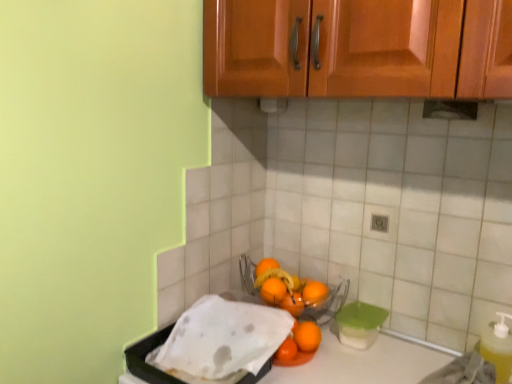
Describe the element at coordinates (224, 337) in the screenshot. The width and height of the screenshot is (512, 384). I see `white paper towel at lower left, which is counted as the second wash, starting from the right` at that location.

Image resolution: width=512 pixels, height=384 pixels. Find the location of `orange matte at lower center, positioned as the 5th orange in bottom-to-top order`. orange matte at lower center, positioned as the 5th orange in bottom-to-top order is located at coordinates (266, 266).

This screenshot has width=512, height=384. What do you see at coordinates (498, 347) in the screenshot?
I see `yellow translucent bottle at lower right` at bounding box center [498, 347].

Describe the element at coordinates (293, 304) in the screenshot. This screenshot has height=384, width=512. I see `orange matte at center, marked as the 4th orange in a top-to-bottom arrangement` at that location.

Measure the distance between point (300, 332) and camera.

Point (300, 332) is 1.12 meters from camera.

What is the approximate width of orange matte at center, the third orange when ordered from top to bottom?

It is 6.79 centimeters.

Locate an element on the screen. white paper towel at lower left, which is counted as the second wash, starting from the right is located at coordinates (224, 337).

Between point (307, 337) and point (291, 306), which one is positioned in front?

The point (307, 337) is in front.

Is orange matte bowl at center, positioned as the 1th wash in right-to-left order, thinner than orange matte at center, marked as the 4th orange in a top-to-bottom arrangement?

Incorrect, the width of orange matte bowl at center, positioned as the 1th wash in right-to-left order, is not less than that of orange matte at center, marked as the 4th orange in a top-to-bottom arrangement.

How different are the orientations of orange matte bowl at center, which is counted as the second wash, starting from the left, and orange matte at center, the 2th orange positioned from the bottom, in degrees?

There is a 0.00176-degree angle between the facing directions of orange matte bowl at center, which is counted as the second wash, starting from the left, and orange matte at center, the 2th orange positioned from the bottom.

Measure the distance from orange matte at lower center, positioned as the 5th orange in bottom-to-top order, to orange matte at center, the 4th orange when ordered from bottom to top.

The distance of orange matte at lower center, positioned as the 5th orange in bottom-to-top order, from orange matte at center, the 4th orange when ordered from bottom to top, is 2.44 inches.

Between orange matte at lower center, positioned as the 5th orange in bottom-to-top order, and orange matte at center, the 4th orange when ordered from bottom to top, which one has more height?

orange matte at lower center, positioned as the 5th orange in bottom-to-top order.

Based on the photo, from the image's perspective, would you say orange matte at lower center, positioned as the 5th orange in bottom-to-top order, is shown under orange matte at center, placed as the second orange when sorted from top to bottom?

No.

Based on the photo, would you say orange matte at center, placed as the second orange when sorted from top to bottom, is part of orange matte at lower center, the 1th orange in the top-to-bottom sequence,'s contents?

No.

Who is taller, orange matte at lower right, which is the 5th orange in top-to-bottom order, or yellow translucent bottle at lower right?

yellow translucent bottle at lower right is taller.

Which object is closer to the camera taking this photo, orange matte at lower right, the 1th orange ordered from the bottom, or yellow translucent bottle at lower right?

yellow translucent bottle at lower right is more forward.

Consider the image. Is orange matte at lower right, the 1th orange ordered from the bottom, completely or partially outside of yellow translucent bottle at lower right?

That's correct, orange matte at lower right, the 1th orange ordered from the bottom, is outside of yellow translucent bottle at lower right.

How many degrees apart are the facing directions of orange matte at lower right, the 1th orange ordered from the bottom, and yellow translucent bottle at lower right?

orange matte at lower right, the 1th orange ordered from the bottom, and yellow translucent bottle at lower right are facing 0.000612 degrees away from each other.

Is the surface of orange matte at lower center, positioned as the 5th orange in bottom-to-top order, in direct contact with orange matte at center, marked as the 4th orange in a top-to-bottom arrangement?

No.

Considering the relative sizes of orange matte at lower center, the 1th orange in the top-to-bottom sequence, and orange matte at center, the 2th orange positioned from the bottom, in the image provided, is orange matte at lower center, the 1th orange in the top-to-bottom sequence, thinner than orange matte at center, the 2th orange positioned from the bottom,?

Incorrect, the width of orange matte at lower center, the 1th orange in the top-to-bottom sequence, is not less than that of orange matte at center, the 2th orange positioned from the bottom.

Considering the relative sizes of orange matte at lower center, positioned as the 5th orange in bottom-to-top order, and orange matte at center, marked as the 4th orange in a top-to-bottom arrangement, in the image provided, is orange matte at lower center, positioned as the 5th orange in bottom-to-top order, shorter than orange matte at center, marked as the 4th orange in a top-to-bottom arrangement,?

No, orange matte at lower center, positioned as the 5th orange in bottom-to-top order, is not shorter than orange matte at center, marked as the 4th orange in a top-to-bottom arrangement.

Looking at this image, who is bigger, orange matte at lower center, positioned as the 5th orange in bottom-to-top order, or orange matte at center, the 2th orange positioned from the bottom?

With larger size is orange matte at lower center, positioned as the 5th orange in bottom-to-top order.

Considering the relative positions of orange matte bowl at center, positioned as the 1th wash in right-to-left order, and yellow translucent bottle at lower right in the image provided, is orange matte bowl at center, positioned as the 1th wash in right-to-left order, to the left of yellow translucent bottle at lower right from the viewer's perspective?

Indeed, orange matte bowl at center, positioned as the 1th wash in right-to-left order, is positioned on the left side of yellow translucent bottle at lower right.

This screenshot has width=512, height=384. Find the location of `wash that is above the yellow translucent bottle at lower right (from the image's perspective)`. wash that is above the yellow translucent bottle at lower right (from the image's perspective) is located at coordinates (285, 288).

From the picture: From the image's perspective, is orange matte bowl at center, positioned as the 1th wash in right-to-left order, above or below yellow translucent bottle at lower right?

From the image's perspective, orange matte bowl at center, positioned as the 1th wash in right-to-left order, appears above yellow translucent bottle at lower right.

From a real-world perspective, which object rests below the other?

yellow translucent bottle at lower right.

Considering the relative sizes of white paper towel at lower left, which is counted as the second wash, starting from the right, and orange matte at center, marked as the 4th orange in a top-to-bottom arrangement, in the image provided, is white paper towel at lower left, which is counted as the second wash, starting from the right, thinner than orange matte at center, marked as the 4th orange in a top-to-bottom arrangement,?

No.

Choose the correct answer: Is white paper towel at lower left, which is counted as the second wash, starting from the right, inside orange matte at center, the 2th orange positioned from the bottom, or outside it?

The correct answer is: outside.

Does point (182, 322) appear closer or farther from the camera than point (293, 308)?

Point (182, 322).

At what (x,y) coordinates should I click in order to perform the action: click on wash located above the white paper towel at lower left, the first wash viewed from the left (from a real-world perspective). Please return your answer as a coordinate pair (x, y). The image size is (512, 384). Looking at the image, I should click on (285, 288).

Is point (264, 334) closer or farther from the camera than point (274, 279)?

Point (264, 334) is positioned closer to the camera compared to point (274, 279).

Consider the image. Is white paper towel at lower left, the first wash viewed from the left, smaller than orange matte bowl at center, positioned as the 1th wash in right-to-left order?

Answer: Actually, white paper towel at lower left, the first wash viewed from the left, might be larger than orange matte bowl at center, positioned as the 1th wash in right-to-left order.

From the image's perspective, between white paper towel at lower left, which is counted as the second wash, starting from the right, and orange matte bowl at center, positioned as the 1th wash in right-to-left order, which one is located above?

From the image's view, orange matte bowl at center, positioned as the 1th wash in right-to-left order, is above.

Which wash is the 1st one when counting from the front of the orange matte at center, marked as the 4th orange in a top-to-bottom arrangement? Please provide its 2D coordinates.

[(285, 288)]

Locate an element on the screen. orange above the orange matte at center, placed as the second orange when sorted from top to bottom (from a real-world perspective) is located at coordinates (266, 266).

Considering their positions, is orange matte at center, marked as the 4th orange in a top-to-bottom arrangement, positioned further to orange matte at center, the third orange when ordered from bottom to top, than orange matte at lower center, the 1th orange in the top-to-bottom sequence?

orange matte at lower center, the 1th orange in the top-to-bottom sequence.

Based on their spatial positions, is orange matte at lower right, which is the 5th orange in top-to-bottom order, or orange matte at center, marked as the 4th orange in a top-to-bottom arrangement, further from orange matte bowl at center, which is counted as the second wash, starting from the left?

Among the two, orange matte at lower right, which is the 5th orange in top-to-bottom order, is located further to orange matte bowl at center, which is counted as the second wash, starting from the left.

Based on their spatial positions, is orange matte at lower right, the 1th orange ordered from the bottom, or orange matte at lower center, positioned as the 5th orange in bottom-to-top order, closer to white paper towel at lower left, the first wash viewed from the left?

orange matte at lower right, the 1th orange ordered from the bottom, is positioned closer to the anchor white paper towel at lower left, the first wash viewed from the left.

Based on their spatial positions, is orange matte bowl at center, positioned as the 1th wash in right-to-left order, or white paper towel at lower left, the first wash viewed from the left, closer to orange matte at lower right, which is the 5th orange in top-to-bottom order?

Answer: orange matte bowl at center, positioned as the 1th wash in right-to-left order, lies closer to orange matte at lower right, which is the 5th orange in top-to-bottom order, than the other object.

Looking at the image, which one is located closer to orange matte at center, the 4th orange when ordered from bottom to top, orange matte bowl at center, positioned as the 1th wash in right-to-left order, or orange matte at lower center, positioned as the 5th orange in bottom-to-top order?

Among the two, orange matte at lower center, positioned as the 5th orange in bottom-to-top order, is located nearer to orange matte at center, the 4th orange when ordered from bottom to top.

When comparing their distances from orange matte at center, the third orange when ordered from top to bottom, does yellow translucent bottle at lower right or orange matte bowl at center, positioned as the 1th wash in right-to-left order, seem closer?

orange matte bowl at center, positioned as the 1th wash in right-to-left order, is positioned closer to the anchor orange matte at center, the third orange when ordered from top to bottom.

From the image, which object appears to be farther from orange matte at lower right, the 1th orange ordered from the bottom, orange matte at center, the third orange when ordered from bottom to top, or white paper towel at lower left, the first wash viewed from the left?

white paper towel at lower left, the first wash viewed from the left, is further to orange matte at lower right, the 1th orange ordered from the bottom.

Considering their positions, is orange matte bowl at center, which is counted as the second wash, starting from the left, positioned closer to orange matte at lower center, positioned as the 5th orange in bottom-to-top order, than yellow translucent bottle at lower right?

orange matte bowl at center, which is counted as the second wash, starting from the left, is closer to orange matte at lower center, positioned as the 5th orange in bottom-to-top order.

The height and width of the screenshot is (384, 512). What are the coordinates of `wash between orange matte at center, the 4th orange when ordered from bottom to top, and yellow translucent bottle at lower right from left to right` in the screenshot? It's located at (285, 288).

You are a GUI agent. You are given a task and a screenshot of the screen. Output one action in this format:
    pyautogui.click(x=<x>, y=<y>)
    Task: Click on the orange positioned between white paper towel at lower left, which is counted as the second wash, starting from the right, and orange matte at center, placed as the second orange when sorted from top to bottom, from near to far
    The height and width of the screenshot is (384, 512).
    Given the screenshot: What is the action you would take?
    pyautogui.click(x=307, y=336)

Where is `orange between orange matte bowl at center, positioned as the 1th wash in right-to-left order, and orange matte at center, the 4th orange when ordered from bottom to top, in the front-back direction`? The width and height of the screenshot is (512, 384). orange between orange matte bowl at center, positioned as the 1th wash in right-to-left order, and orange matte at center, the 4th orange when ordered from bottom to top, in the front-back direction is located at coordinates (307, 336).

The width and height of the screenshot is (512, 384). I want to click on wash located between white paper towel at lower left, the first wash viewed from the left, and orange matte at center, the 2th orange positioned from the bottom, in the depth direction, so click(x=285, y=288).